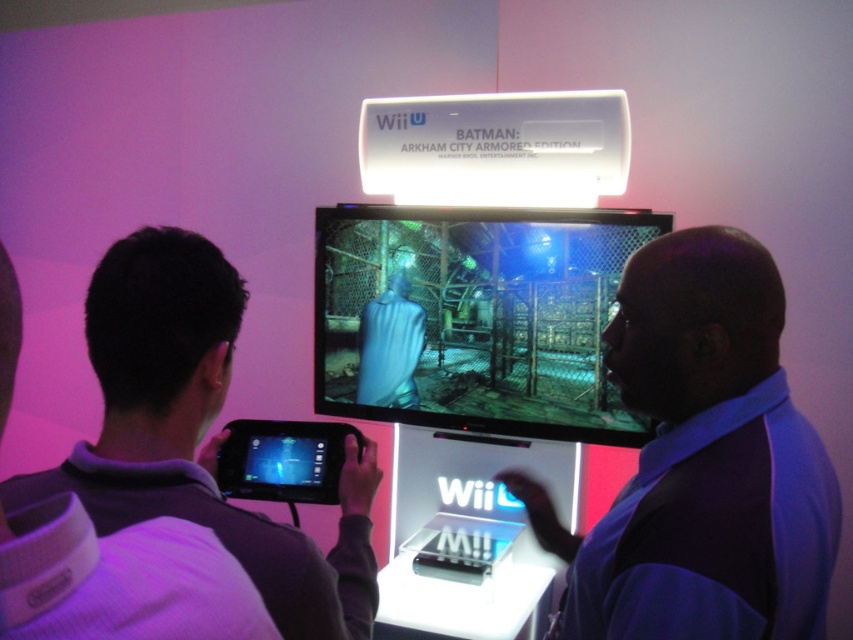
From the picture: Which is below, matte black monitor at center or black plastic handheld device at lower center?

black plastic handheld device at lower center is below.

Does matte black monitor at center come behind black plastic handheld device at lower center?

Yes, it is behind black plastic handheld device at lower center.

Where is `matte black monitor at center`? Image resolution: width=853 pixels, height=640 pixels. matte black monitor at center is located at coordinates (473, 317).

Find the location of a particular element. The width and height of the screenshot is (853, 640). blue fabric shirt at right is located at coordinates (701, 461).

Between blue fabric shirt at right and black plastic handheld device at lower center, which one has less height?

black plastic handheld device at lower center

Who is more distant from viewer, (804, 524) or (337, 429)?

The point (337, 429) is behind.

Image resolution: width=853 pixels, height=640 pixels. I want to click on blue fabric shirt at right, so click(701, 461).

Who is more distant from viewer, (125, 349) or (253, 490)?

The point (253, 490) is behind.

Does purple fabric shirt at upper left appear under black plastic handheld device at lower center?

No.

Which is in front, point (341, 563) or point (287, 452)?

Point (341, 563) is more forward.

Where is `purple fabric shirt at upper left`? This screenshot has height=640, width=853. purple fabric shirt at upper left is located at coordinates 198,433.